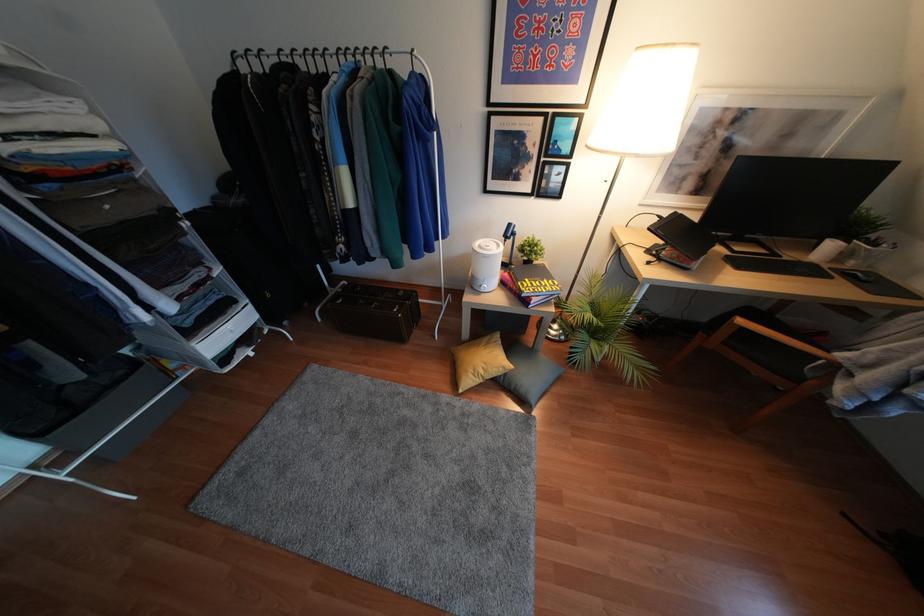
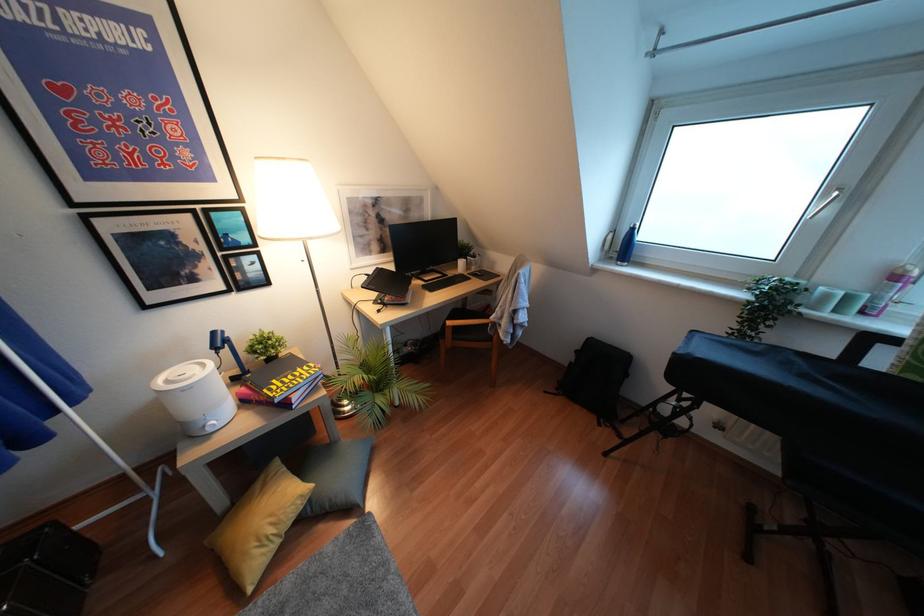
Where in the second image is the point corresponding to [868,281] from the first image?

(481, 274)